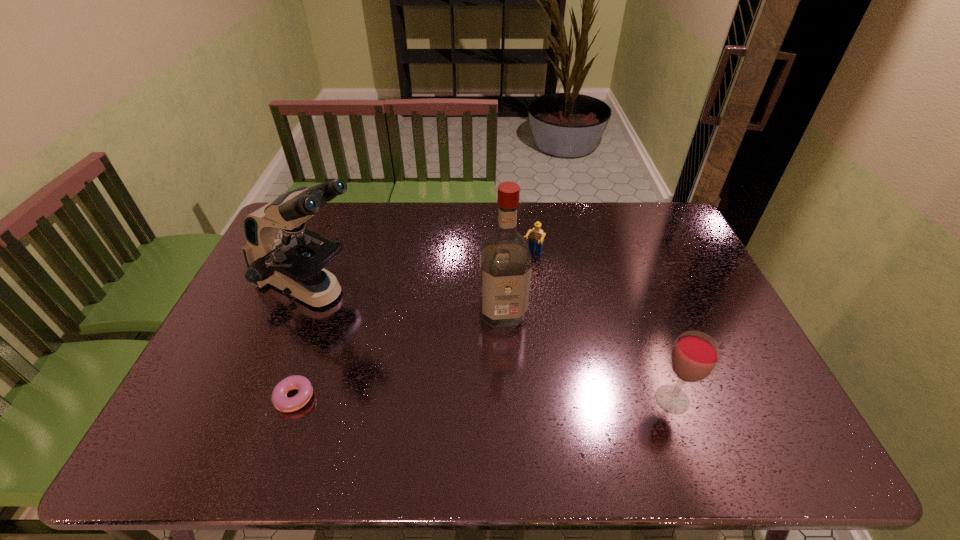
This screenshot has height=540, width=960. Find the location of `free space on the desktop that is between the doughnut and the third tallest object and is positioned on the face of the fourth tallest object`. free space on the desktop that is between the doughnut and the third tallest object and is positioned on the face of the fourth tallest object is located at coordinates (456, 400).

Image resolution: width=960 pixels, height=540 pixels. In order to click on free space on the desktop that is between the doughnut and the rightmost object and is positioned on the front-facing side of the third object from left to right in this screenshot , I will do `click(518, 399)`.

In order to click on vacant spot on the desktop that is between the doughnut and the third tallest object and is positioned through the eyepieces of the microscope in this screenshot , I will do `click(529, 399)`.